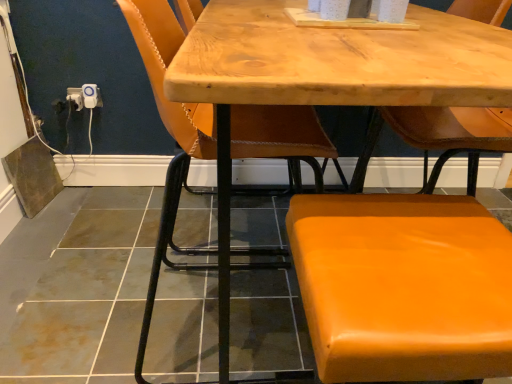
Question: Considering the relative positions of orange leather stool at lower right, which ranks as the 2th chair in left-to-right order, and orange leather chair at center, the 1th chair from the left, in the image provided, is orange leather stool at lower right, which ranks as the 2th chair in left-to-right order, in front of orange leather chair at center, the 1th chair from the left,?

Choices:
 (A) yes
 (B) no

Answer: (A)

Question: Considering the relative sizes of orange leather stool at lower right, acting as the first chair starting from the right, and orange leather chair at center, the 1th chair from the left, in the image provided, is orange leather stool at lower right, acting as the first chair starting from the right, shorter than orange leather chair at center, the 1th chair from the left,?

Choices:
 (A) yes
 (B) no

Answer: (A)

Question: Is orange leather stool at lower right, which ranks as the 2th chair in left-to-right order, further to the viewer compared to orange leather chair at center, placed as the second chair when sorted from right to left?

Choices:
 (A) yes
 (B) no

Answer: (B)

Question: From the image's perspective, does orange leather stool at lower right, which ranks as the 2th chair in left-to-right order, appear higher than orange leather chair at center, placed as the second chair when sorted from right to left?

Choices:
 (A) no
 (B) yes

Answer: (A)

Question: Is orange leather stool at lower right, acting as the first chair starting from the right, thinner than orange leather chair at center, the 1th chair from the left?

Choices:
 (A) no
 (B) yes

Answer: (B)

Question: Is orange leather stool at lower right, which ranks as the 2th chair in left-to-right order, smaller than orange leather chair at center, placed as the second chair when sorted from right to left?

Choices:
 (A) yes
 (B) no

Answer: (A)

Question: From a real-world perspective, is white plastic outlet at lower left, arranged as the second electric outlet when viewed from the left, physically above white plastic electrical outlet at lower left, arranged as the second electric outlet when viewed from the right?

Choices:
 (A) no
 (B) yes

Answer: (B)

Question: Considering the relative sizes of white plastic outlet at lower left, arranged as the second electric outlet when viewed from the left, and white plastic electrical outlet at lower left, which is counted as the 1th electric outlet, starting from the left, in the image provided, is white plastic outlet at lower left, arranged as the second electric outlet when viewed from the left, smaller than white plastic electrical outlet at lower left, which is counted as the 1th electric outlet, starting from the left,?

Choices:
 (A) yes
 (B) no

Answer: (A)

Question: From the image's perspective, is white plastic outlet at lower left, arranged as the 1th electric outlet when viewed from the right, located above white plastic electrical outlet at lower left, which is counted as the 1th electric outlet, starting from the left?

Choices:
 (A) yes
 (B) no

Answer: (A)

Question: Are white plastic outlet at lower left, arranged as the 1th electric outlet when viewed from the right, and white plastic electrical outlet at lower left, which is counted as the 1th electric outlet, starting from the left, making contact?

Choices:
 (A) no
 (B) yes

Answer: (B)

Question: Is white plastic outlet at lower left, arranged as the second electric outlet when viewed from the left, not near white plastic electrical outlet at lower left, arranged as the second electric outlet when viewed from the right?

Choices:
 (A) yes
 (B) no

Answer: (B)

Question: Would you say white plastic outlet at lower left, arranged as the 1th electric outlet when viewed from the right, contains white plastic electrical outlet at lower left, which is counted as the 1th electric outlet, starting from the left?

Choices:
 (A) yes
 (B) no

Answer: (B)

Question: Does white plastic outlet at lower left, arranged as the 1th electric outlet when viewed from the right, turn towards wooden table at center?

Choices:
 (A) no
 (B) yes

Answer: (A)